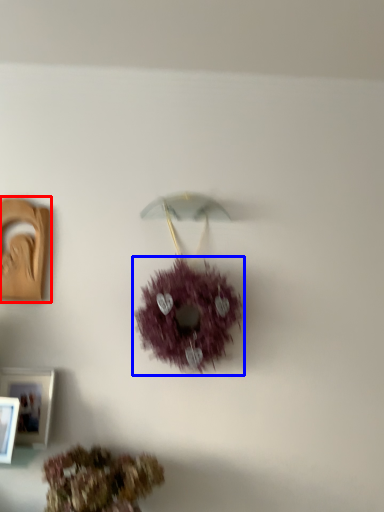
Question: Which of the following is the farthest to the observer, picture frame (highlighted by a red box) or flower (highlighted by a blue box)?

Choices:
 (A) picture frame
 (B) flower

Answer: (A)